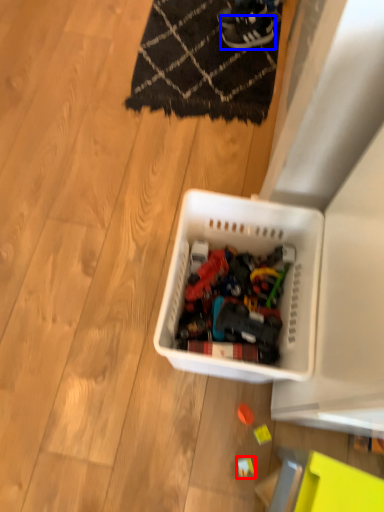
Question: Among these objects, which one is nearest to the camera, toy (highlighted by a red box) or footwear (highlighted by a blue box)?

Choices:
 (A) toy
 (B) footwear

Answer: (A)